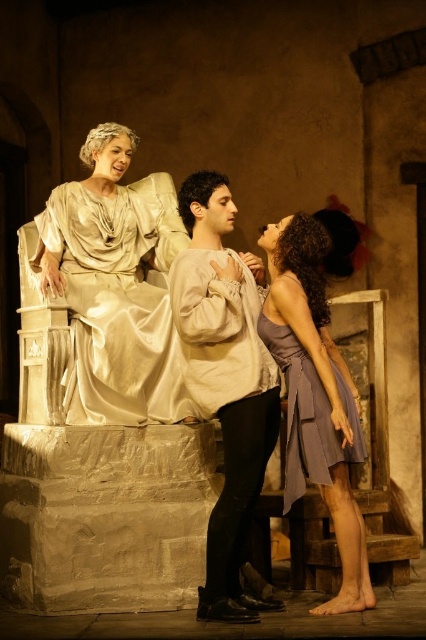
Question: Is satin dress at upper left closer to camera compared to matte purple dress at center?

Choices:
 (A) yes
 (B) no

Answer: (B)

Question: Does satin dress at upper left come in front of matte purple dress at center?

Choices:
 (A) yes
 (B) no

Answer: (B)

Question: Considering the real-world distances, which object is farthest from the satin dress at upper left?

Choices:
 (A) matte purple dress at center
 (B) matte white shirt at center

Answer: (A)

Question: Considering the real-world distances, which object is farthest from the matte white shirt at center?

Choices:
 (A) satin dress at upper left
 (B) matte purple dress at center

Answer: (A)

Question: Is satin dress at upper left above matte purple dress at center?

Choices:
 (A) yes
 (B) no

Answer: (A)

Question: Which point appears closest to the camera in this image?

Choices:
 (A) (325, 392)
 (B) (63, 232)
 (C) (239, 358)

Answer: (A)